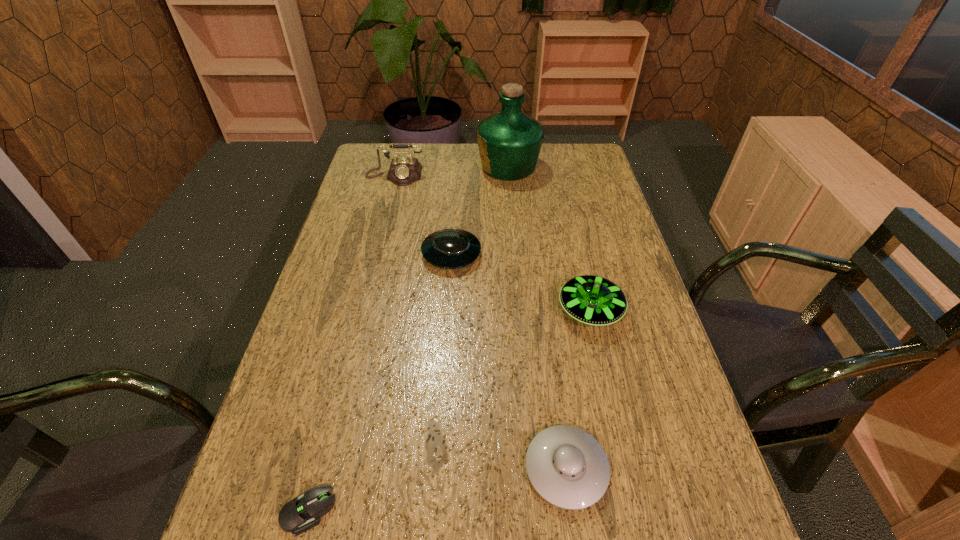
Identify the location of the tallest object. (509, 142).

Find the location of `telephone`. telephone is located at coordinates (403, 171).

The image size is (960, 540). What are the coordinates of `the fourth shortest object` in the screenshot? It's located at (593, 300).

This screenshot has height=540, width=960. Find the location of `the tallest saucer`. the tallest saucer is located at coordinates (593, 300).

Locate an element on the screen. the leftmost saucer is located at coordinates (449, 248).

At what (x,y) coordinates should I click in order to perform the action: click on the farthest saucer. Please return your answer as a coordinate pair (x, y). Image resolution: width=960 pixels, height=540 pixels. Looking at the image, I should click on [449, 248].

The width and height of the screenshot is (960, 540). In order to click on the nearest saucer in this screenshot , I will do `click(567, 467)`.

You are a GUI agent. You are given a task and a screenshot of the screen. Output one action in this format:
    pyautogui.click(x=<x>, y=<y>)
    Task: Click on the computer mouse
    
    Given the screenshot: What is the action you would take?
    pyautogui.click(x=297, y=516)

The height and width of the screenshot is (540, 960). In order to click on vacant area situated on the label side of the liquor in this screenshot , I will do `click(411, 167)`.

The image size is (960, 540). I want to click on vacant space situated on the label side of the liquor, so click(x=414, y=167).